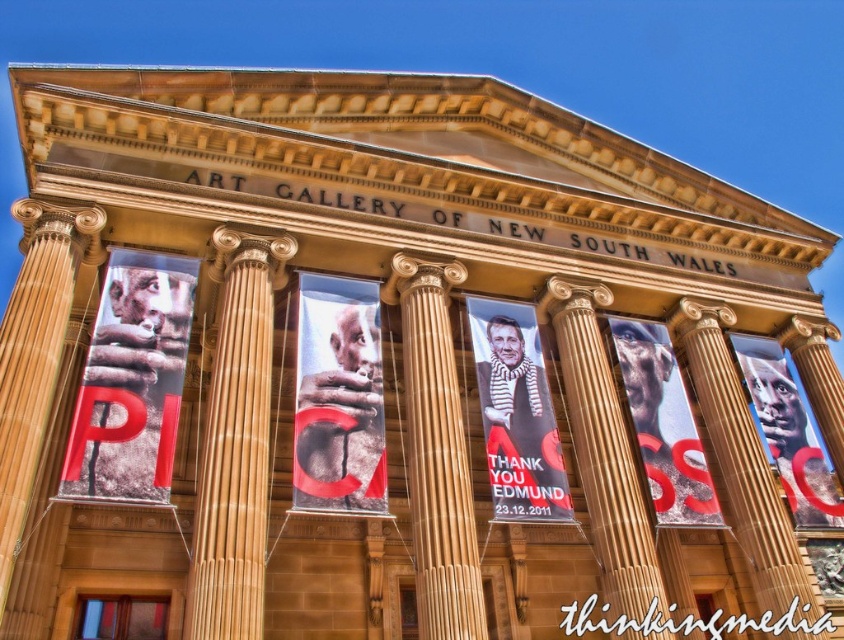
Question: Considering the relative positions of smooth stone column at center and sandy stone column at left in the image provided, where is smooth stone column at center located with respect to sandy stone column at left?

Choices:
 (A) right
 (B) left

Answer: (A)

Question: Among these objects, which one is nearest to the camera?

Choices:
 (A) golden stone column at center
 (B) brown stone column at center
 (C) golden stone pillar at center
 (D) matte black portrait at center

Answer: (A)

Question: Can you confirm if smooth stone column at center is positioned to the left of brown stone column at center?

Choices:
 (A) no
 (B) yes

Answer: (B)

Question: Can you confirm if matte black banner at left is positioned above sandy stone column at left?

Choices:
 (A) no
 (B) yes

Answer: (B)

Question: Which point is closer to the camera?

Choices:
 (A) (199, 620)
 (B) (422, 362)

Answer: (A)

Question: Among these objects, which one is nearest to the camera?

Choices:
 (A) golden stone pillar at center
 (B) matte black hands at center
 (C) matte black banner at left
 (D) matte black scarf at center

Answer: (C)